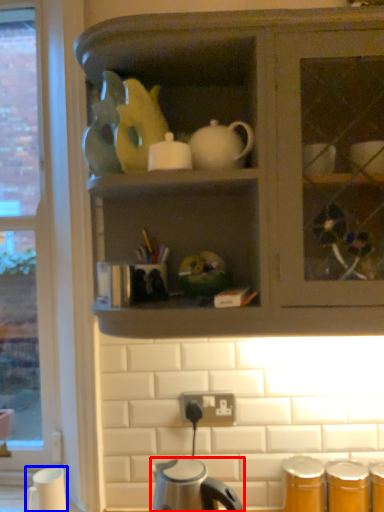
Question: Which of the following is the farthest to the observer, kettle (highlighted by a red box) or coffee cup (highlighted by a blue box)?

Choices:
 (A) kettle
 (B) coffee cup

Answer: (B)